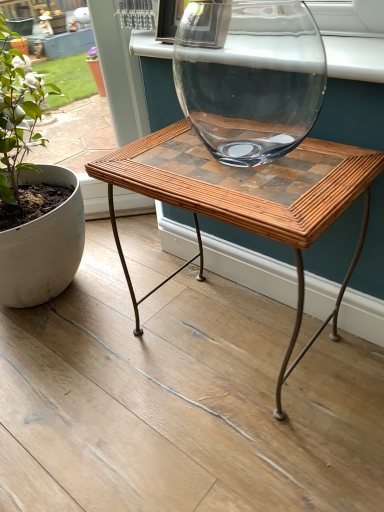
The width and height of the screenshot is (384, 512). I want to click on clear glass vase at upper center, so click(x=355, y=58).

Locate an element on the screen. woven wood table at center is located at coordinates (x=246, y=200).

Is green matte plant at left positioned before woven wood table at center?

No, green matte plant at left is further to the viewer.

How distant is green matte plant at left from woven wood table at center?

A distance of 42.92 centimeters exists between green matte plant at left and woven wood table at center.

Is green matte plant at left positioned far away from woven wood table at center?

green matte plant at left is actually quite close to woven wood table at center.

Could you tell me if green matte plant at left is facing woven wood table at center?

No, green matte plant at left is not aimed at woven wood table at center.

Are woven wood table at center and clear glass vase at upper center far apart?

woven wood table at center is near clear glass vase at upper center, not far away.

Is woven wood table at center aimed at clear glass vase at upper center?

No, woven wood table at center does not turn towards clear glass vase at upper center.

Can you confirm if woven wood table at center is wider than clear glass vase at upper center?

Indeed, woven wood table at center has a greater width compared to clear glass vase at upper center.

Where is `window sill lying behind the green matte plant at left`? Image resolution: width=384 pixels, height=512 pixels. window sill lying behind the green matte plant at left is located at coordinates (355, 58).

Between green matte plant at left and clear glass vase at upper center, which one is positioned in front?

green matte plant at left is closer to the camera.

Is green matte plant at left oriented towards clear glass vase at upper center?

No, green matte plant at left is not oriented towards clear glass vase at upper center.

Is green matte plant at left not near clear glass vase at upper center?

No, green matte plant at left is not far away from clear glass vase at upper center.

Would you consider woven wood table at center to be distant from green matte plant at left?

No, woven wood table at center is not far away from green matte plant at left.

Would you say green matte plant at left is part of woven wood table at center's contents?

Definitely not — green matte plant at left is not inside woven wood table at center.

Considering the positions of objects woven wood table at center and green matte plant at left in the image provided, who is more to the left, woven wood table at center or green matte plant at left?

green matte plant at left.

Is woven wood table at center closer to the viewer compared to green matte plant at left?

That is True.

Which of these two, clear glass vase at upper center or woven wood table at center, is smaller?

clear glass vase at upper center.

Between clear glass vase at upper center and woven wood table at center, which one appears on the left side from the viewer's perspective?

clear glass vase at upper center.

Based on the photo, from a real-world perspective, is clear glass vase at upper center physically located above or below woven wood table at center?

Clearly, from a real-world perspective, clear glass vase at upper center is above woven wood table at center.

Is clear glass vase at upper center placed right next to green matte plant at left?

No, clear glass vase at upper center is not in contact with green matte plant at left.

Can you confirm if clear glass vase at upper center is shorter than green matte plant at left?

Correct, clear glass vase at upper center is not as tall as green matte plant at left.

Can you confirm if clear glass vase at upper center is wider than green matte plant at left?

In fact, clear glass vase at upper center might be narrower than green matte plant at left.

From the image's perspective, is clear glass vase at upper center on green matte plant at left?

Yes, from the image's perspective, clear glass vase at upper center is above green matte plant at left.

Find the location of a particular element. Image resolution: width=384 pixels, height=512 pixels. houseplant positioned vertically above the woven wood table at center (from a real-world perspective) is located at coordinates (x=33, y=194).

Where is `window sill above the woven wood table at center (from the image's perspective)`? This screenshot has width=384, height=512. window sill above the woven wood table at center (from the image's perspective) is located at coordinates (355, 58).

Estimate the real-world distances between objects in this image. Which object is further from clear glass vase at upper center, woven wood table at center or green matte plant at left?

green matte plant at left.

Considering their positions, is woven wood table at center positioned further to green matte plant at left than clear glass vase at upper center?

clear glass vase at upper center lies further to green matte plant at left than the other object.

Estimate the real-world distances between objects in this image. Which object is closer to woven wood table at center, clear glass vase at upper center or green matte plant at left?

Based on the image, clear glass vase at upper center appears to be nearer to woven wood table at center.

Looking at the image, which one is located closer to green matte plant at left, clear glass vase at upper center or woven wood table at center?

woven wood table at center.

Estimate the real-world distances between objects in this image. Which object is further from clear glass vase at upper center, green matte plant at left or woven wood table at center?

green matte plant at left lies further to clear glass vase at upper center than the other object.

Looking at the image, which one is located further to woven wood table at center, green matte plant at left or clear glass vase at upper center?

Among the two, green matte plant at left is located further to woven wood table at center.

This screenshot has width=384, height=512. What are the coordinates of `window sill located between green matte plant at left and woven wood table at center in the left-right direction` in the screenshot? It's located at (355, 58).